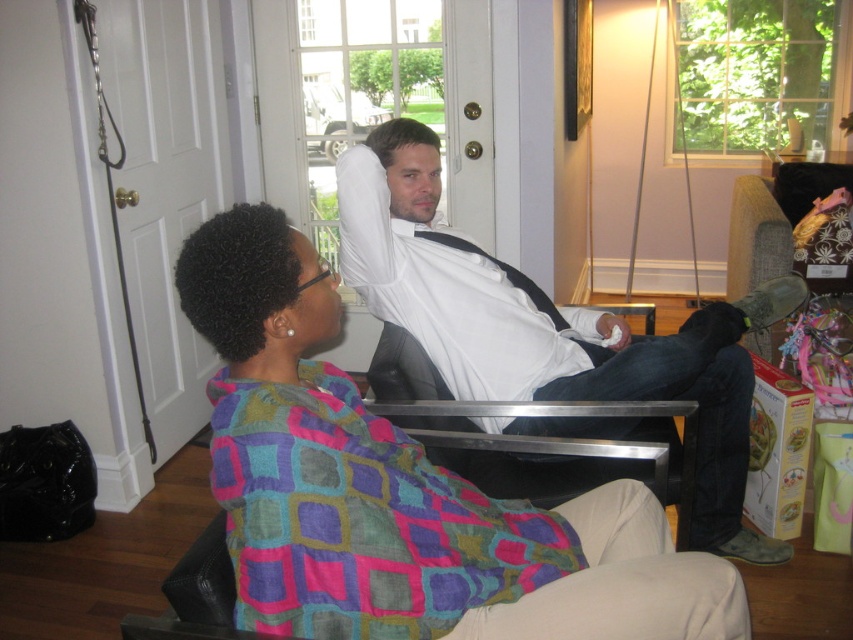
You are standing in the living room and want to place a new decorative pillow exactly at the center of the room. The multicolored fabric at center is currently occupying that spot. Can you move it to make space for the new pillow?

The multicolored fabric at center is already positioned at the center of the room at point (399,490), so you can move it to make space for the new pillow.

You are a photographer setting up a shoot in this living room. You need to ensure that the multicolored fabric at center and the white cotton shirt at center are both in focus. Given that your camera can only focus on objects within a 1 meter depth range, can you capture both items clearly in the same photo?

The multicolored fabric at center is closer to the viewer than the white cotton shirt at center. Since the camera can focus on objects within a 1 meter depth range, you need to check the distance between them. If the depth between the two objects is within 1 meter, then yes, they can both be in focus. However, if the distance exceeds 1 meter, only one can be in focus at a time.

You are a photographer setting up a shoot in the living room. You need to position a small reflector to bounce light onto the multicolored fabric at center and the white cotton shirt at center. Since the reflector can only be placed below the lower of the two items, where should you place it?

The multicolored fabric at center is below the white cotton shirt at center, so the reflector should be placed below the multicolored fabric at center.